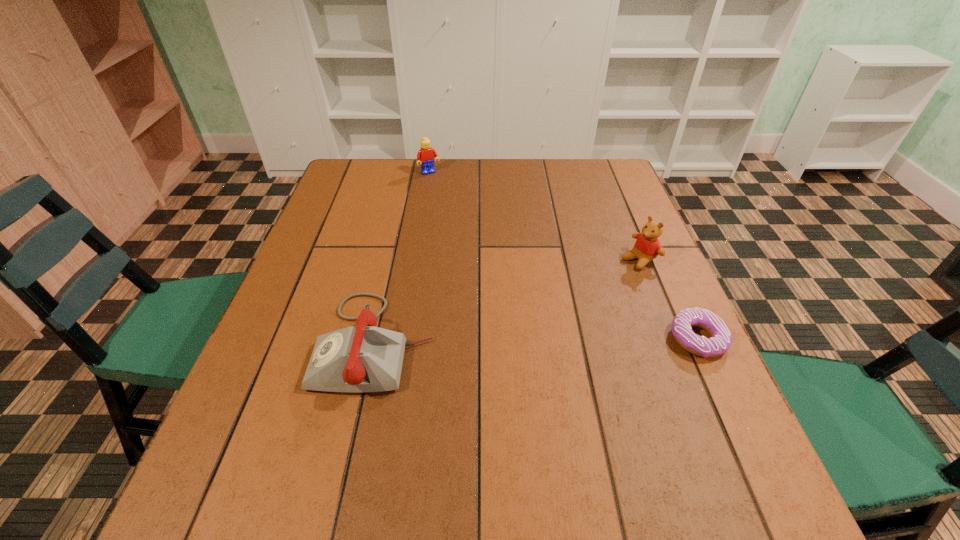
I want to click on the third tallest object, so click(x=364, y=358).

What are the coordinates of `the shortest object` in the screenshot? It's located at (721, 338).

Locate an element on the screen. The height and width of the screenshot is (540, 960). the farthest object is located at coordinates (426, 154).

I want to click on teddy bear, so click(x=647, y=247).

Find the location of `vacant region located 0.080m on the dial of the second shortest object`. vacant region located 0.080m on the dial of the second shortest object is located at coordinates (281, 342).

Find the location of a particular element. This screenshot has height=540, width=960. vacant point located 0.090m on the dial of the second shortest object is located at coordinates (276, 342).

Identify the location of vacant space located 0.330m on the left of the shortest object. This screenshot has width=960, height=540. (513, 340).

Where is `free space located on the front-facing side of the Lego`? This screenshot has width=960, height=540. free space located on the front-facing side of the Lego is located at coordinates (459, 218).

The height and width of the screenshot is (540, 960). I want to click on vacant space located 0.400m on the front-facing side of the Lego, so click(479, 250).

Locate an element on the screen. free space located on the front-facing side of the Lego is located at coordinates (463, 224).